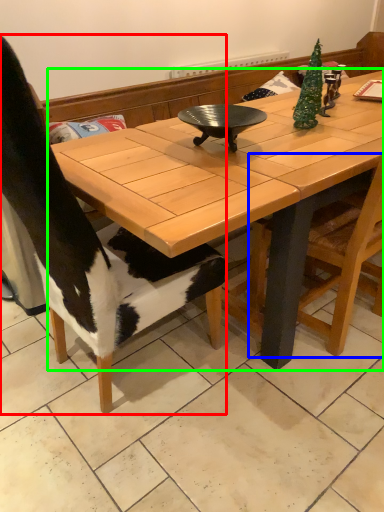
Question: Based on their relative distances, which object is farther from chair (highlighted by a red box)? Choose from chair (highlighted by a blue box) and coffee table (highlighted by a green box).

Choices:
 (A) chair
 (B) coffee table

Answer: (A)